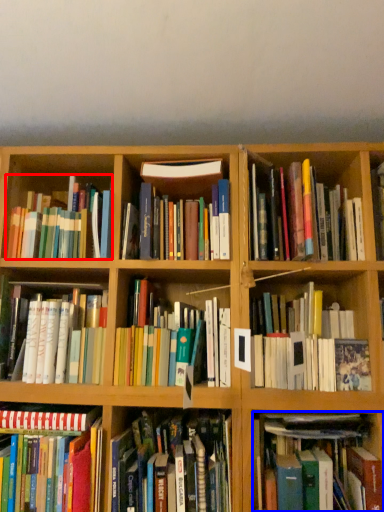
Question: Which object appears closest to the camera in this image, book (highlighted by a red box) or book (highlighted by a blue box)?

Choices:
 (A) book
 (B) book

Answer: (B)